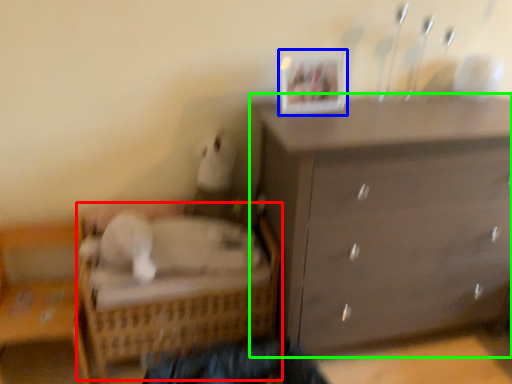
Question: Which is nearer to the bed (highlighted by a red box)? picture frame (highlighted by a blue box) or chest of drawers (highlighted by a green box).

Choices:
 (A) picture frame
 (B) chest of drawers

Answer: (B)